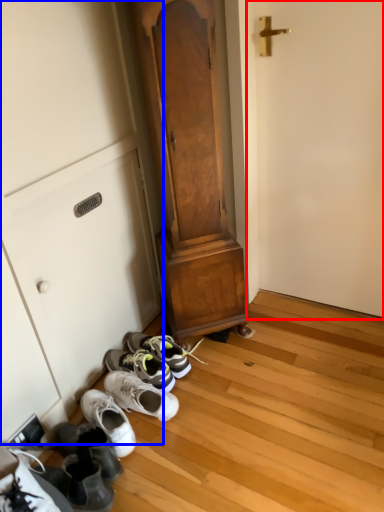
Question: Which object is further to the camera taking this photo, door (highlighted by a red box) or cabinetry (highlighted by a blue box)?

Choices:
 (A) door
 (B) cabinetry

Answer: (B)